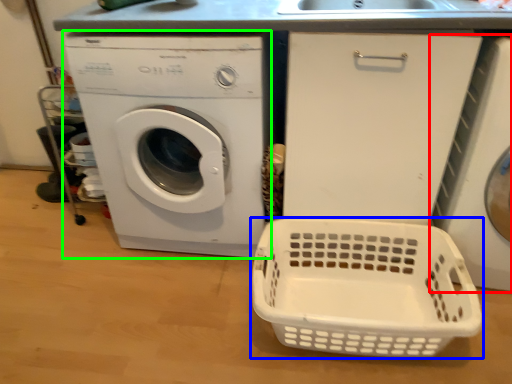
Question: Considering the real-world distances, which object is closest to washing machine (highlighted by a red box)? basket (highlighted by a blue box) or washing machine (highlighted by a green box).

Choices:
 (A) basket
 (B) washing machine

Answer: (A)